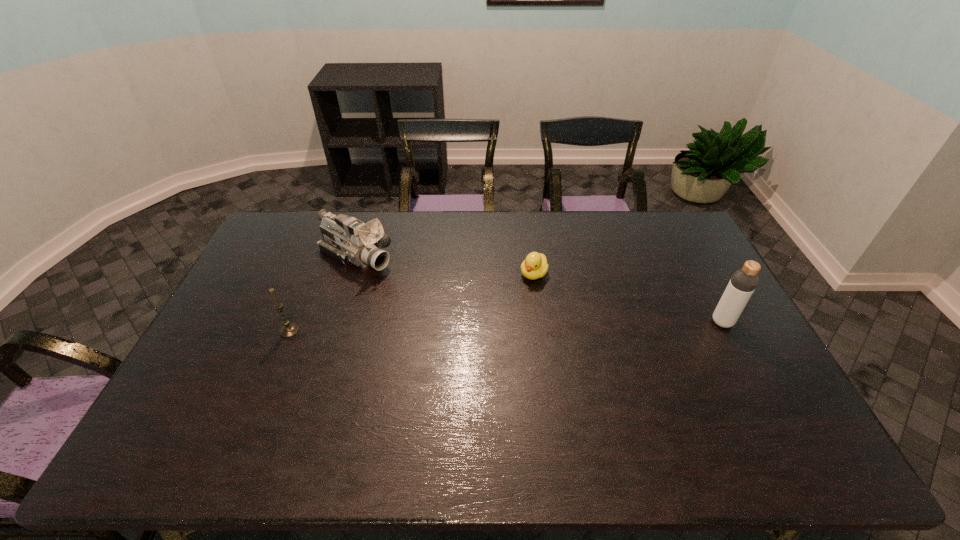
What are the coordinates of `vacant space that is in between the tallest object and the candle` in the screenshot? It's located at (506, 327).

Identify the location of blank region between the bottle and the candle. The height and width of the screenshot is (540, 960). (506, 327).

Locate an element on the screen. The height and width of the screenshot is (540, 960). object that is the third closest to the duckling is located at coordinates (288, 330).

Image resolution: width=960 pixels, height=540 pixels. In order to click on object that is the third closest to the shortest object in this screenshot , I will do `click(288, 330)`.

Find the location of a particular element. vacant position in the image that satisfies the following two spatial constraints: 1. on the front side of the third object from left to right; 2. on the right side of the camcorder is located at coordinates (351, 274).

Locate an element on the screen. free location that satisfies the following two spatial constraints: 1. on the front side of the camcorder; 2. on the right side of the bottle is located at coordinates (336, 322).

This screenshot has width=960, height=540. Find the location of `free location that satisfies the following two spatial constraints: 1. on the front side of the tallest object; 2. on the left side of the shortest object`. free location that satisfies the following two spatial constraints: 1. on the front side of the tallest object; 2. on the left side of the shortest object is located at coordinates (540, 322).

You are a GUI agent. You are given a task and a screenshot of the screen. Output one action in this format:
    pyautogui.click(x=<x>, y=<y>)
    Task: Click on the blank space that satisfies the following two spatial constraints: 1. on the front side of the camcorder; 2. on the left side of the tallest object
    This screenshot has width=960, height=540.
    Given the screenshot: What is the action you would take?
    pyautogui.click(x=336, y=322)